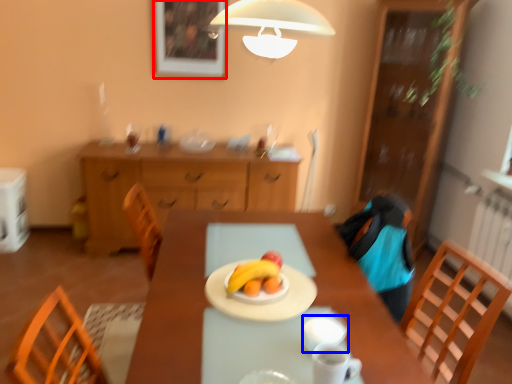
Question: Which object appears closest to the camera in this image, picture frame (highlighted by a red box) or tableware (highlighted by a blue box)?

Choices:
 (A) picture frame
 (B) tableware

Answer: (B)